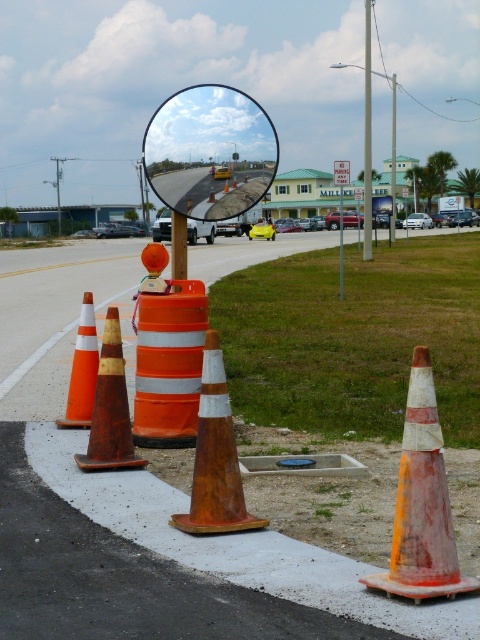
Locate an element on the screen. The height and width of the screenshot is (640, 480). orange reflective cone at lower right is located at coordinates (421, 502).

Can you confirm if orange reflective cone at lower right is positioned to the right of orange/reflective traffic cone at center?

Incorrect, orange reflective cone at lower right is not on the right side of orange/reflective traffic cone at center.

Find the location of a particular element. Image resolution: width=480 pixels, height=640 pixels. orange reflective cone at lower right is located at coordinates (421, 502).

Who is higher up, orange/reflective traffic cone at center or orange plastic pole at center?

Positioned higher is orange/reflective traffic cone at center.

Between point (364, 204) and point (172, 250), which one is positioned behind?

The point (364, 204) is more distant.

Measure the distance between orange/reflective traffic cone at center and camera.

orange/reflective traffic cone at center and camera are 38.91 meters apart from each other.

You are a GUI agent. You are given a task and a screenshot of the screen. Output one action in this format:
    pyautogui.click(x=<x>, y=<y>)
    Task: Click on the orange/reflective traffic cone at center
    
    Given the screenshot: What is the action you would take?
    pyautogui.click(x=368, y=138)

Looking at this image, is orange reflective barrel at center taller than brushed metal pole at upper center?

No.

This screenshot has height=640, width=480. What are the coordinates of `orange reflective barrel at center` in the screenshot? It's located at (168, 364).

In order to click on orange reflective barrel at center in this screenshot , I will do `click(168, 364)`.